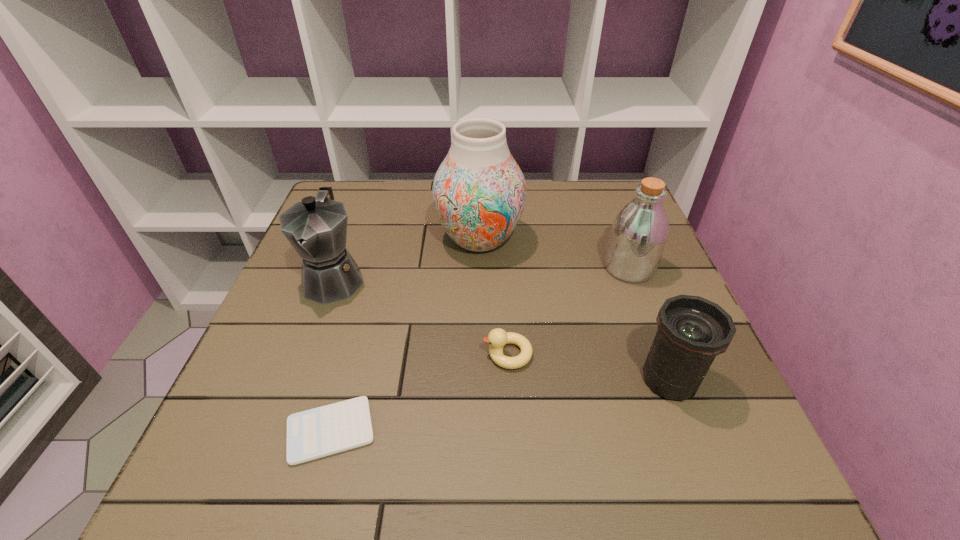
You are a GUI agent. You are given a task and a screenshot of the screen. Output one action in this format:
    pyautogui.click(x=<x>, y=<y>)
    Task: Click on the blank space that satisfies the following two spatial constraints: 1. on the back side of the calculator; 2. on the right side of the telephoto lens
    This screenshot has width=960, height=540.
    Given the screenshot: What is the action you would take?
    pyautogui.click(x=345, y=380)

In order to click on vacant space that satisfies the following two spatial constraints: 1. at the spout of the shortest object; 2. on the left side of the coffeepot in this screenshot , I will do `click(278, 430)`.